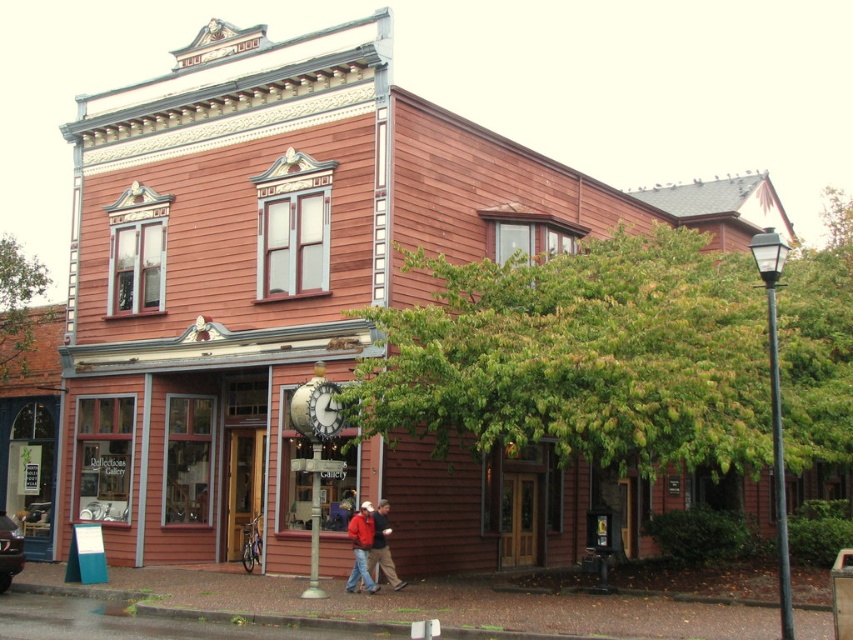
You are standing in front of the two story building and see the red jacket at center and the wooden clock at center. Which object is positioned to the right when facing the building?

The red jacket at center is positioned to the right of the wooden clock at center when facing the building.

You are a delivery person trying to place a new sign that is 2 meters wide on the building. The sign must be placed where there is enough space. Which object should you choose between the wooden storefront at center and the wooden clock at center?

The wooden storefront at center has a larger size compared to the wooden clock at center, so the delivery person should place the new sign on the wooden storefront at center as it has sufficient space.